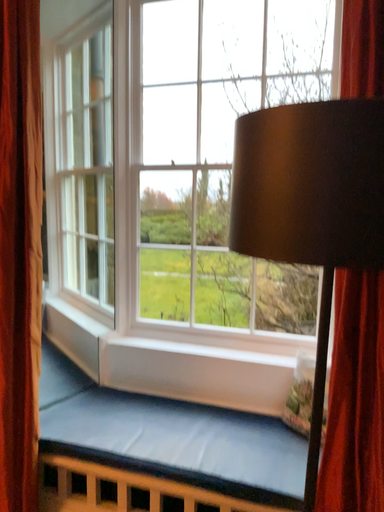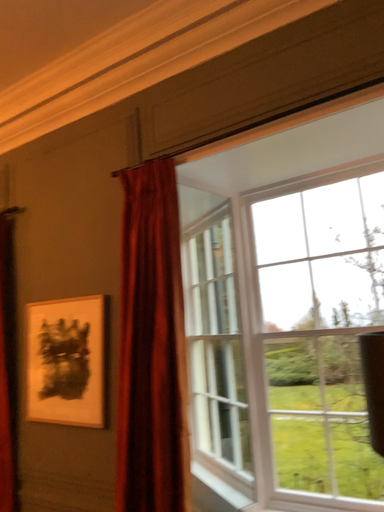
Question: How did the camera likely rotate when shooting the video?

Choices:
 (A) rotated upward
 (B) rotated downward

Answer: (A)